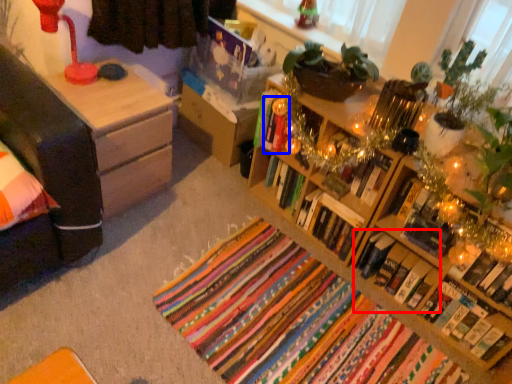
Question: Which of the following is the farthest to the observer, book (highlighted by a red box) or book (highlighted by a blue box)?

Choices:
 (A) book
 (B) book

Answer: (B)